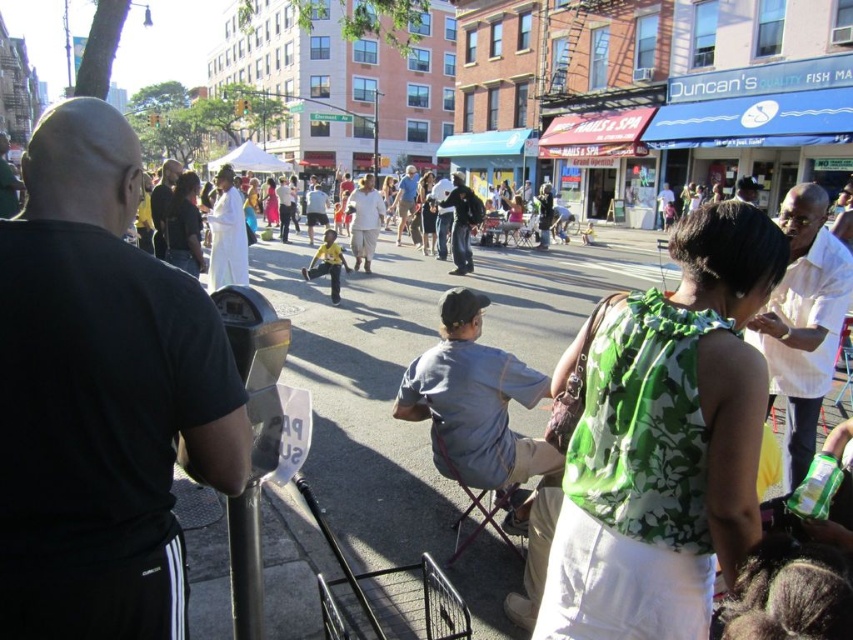
You are a pedestrian on the street and want to find the person wearing the green floral blouse at center. Which direction should you look relative to the white shirt at right?

The green floral blouse at center is below the white shirt at right, so you should look downward from the white shirt at right to find the person wearing the green floral blouse at center.

What are the coordinates of the green floral blouse at center?

The green floral blouse at center is located at coordinates point [666,442].

You are a pedestrian trying to cross the street safely. There is a black matte t shirt at upper left represented by point (100, 396). Is the black matte t shirt at upper left visible from your current position?

The black matte t shirt at upper left represented by point (100, 396) is visible from your current position because there are no obstructions mentioned in the scene description that would block the view of that point.